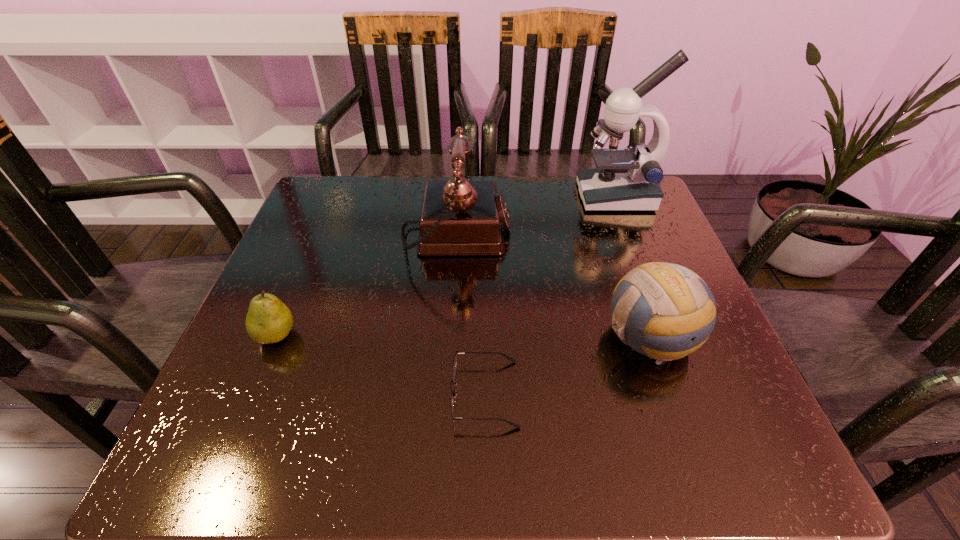
Identify the location of vacant area at the far edge of the desktop. (419, 216).

You are a GUI agent. You are given a task and a screenshot of the screen. Output one action in this format:
    pyautogui.click(x=<x>, y=<y>)
    Task: Click on the free space at the left edge of the desktop
    The image size is (960, 540).
    Given the screenshot: What is the action you would take?
    pyautogui.click(x=243, y=339)

This screenshot has height=540, width=960. In order to click on vacant space at the right edge in this screenshot , I will do `click(648, 257)`.

Locate an element on the screen. This screenshot has height=540, width=960. vacant space at the far left corner is located at coordinates (370, 201).

In order to click on vacant area at the near right corner in this screenshot , I will do `click(691, 429)`.

This screenshot has height=540, width=960. I want to click on free spot between the leftmost object and the telephone, so click(x=366, y=285).

The height and width of the screenshot is (540, 960). I want to click on unoccupied position between the pear and the third tallest object, so click(463, 336).

Find the location of `free space that is in between the microscope and the third tallest object`. free space that is in between the microscope and the third tallest object is located at coordinates (633, 266).

Locate an element on the screen. The height and width of the screenshot is (540, 960). free space between the telephone and the microscope is located at coordinates (536, 216).

The image size is (960, 540). In order to click on vacant area between the leftmost object and the third shortest object in this screenshot , I will do `click(463, 336)`.